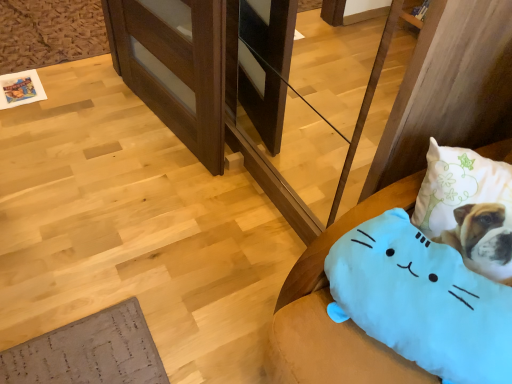
Question: In terms of size, does blue plush cat at lower right appear bigger or smaller than blue plush cat at lower right?

Choices:
 (A) small
 (B) big

Answer: (B)

Question: Which is correct: blue plush cat at lower right is inside blue plush cat at lower right, or outside of it?

Choices:
 (A) inside
 (B) outside

Answer: (B)

Question: Which is farther from the blue plush cat at lower right?

Choices:
 (A) wooden at left
 (B) blue plush cat at lower right

Answer: (A)

Question: Which object is positioned closest to the wooden at left?

Choices:
 (A) blue plush cat at lower right
 (B) blue plush cat at lower right

Answer: (B)